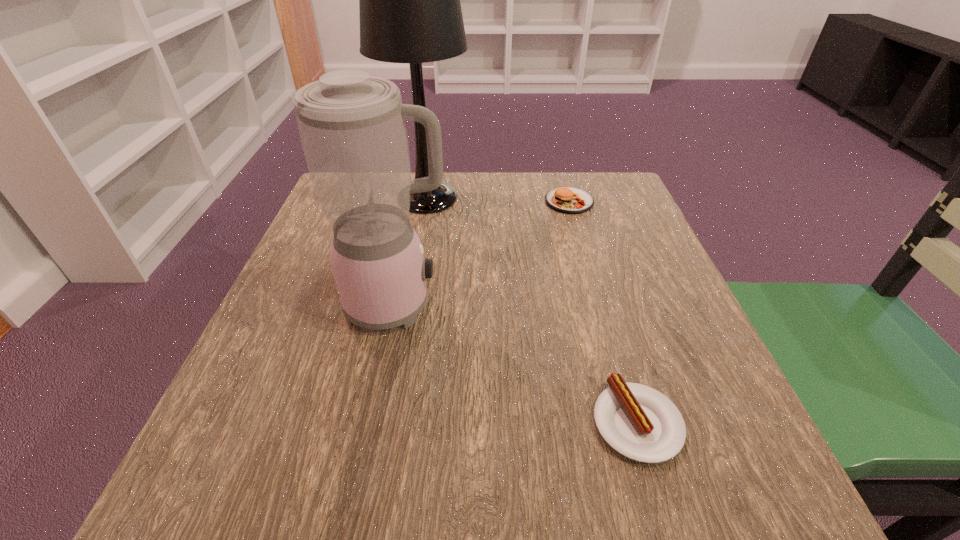
This screenshot has height=540, width=960. I want to click on free point between the patty and the nearest object, so 603,312.

Identify the location of unoccupied position between the table lamp and the sausage. Image resolution: width=960 pixels, height=540 pixels. (532, 310).

The image size is (960, 540). In order to click on vacant area between the sausage and the patty in this screenshot , I will do `click(603, 312)`.

At what (x,y) coordinates should I click in order to perform the action: click on vacant space that's between the sausage and the tallest object. Please return your answer as a coordinate pair (x, y). This screenshot has height=540, width=960. Looking at the image, I should click on (532, 310).

The image size is (960, 540). I want to click on unoccupied area between the sausage and the patty, so click(x=603, y=312).

I want to click on free spot between the sausage and the table lamp, so click(x=532, y=310).

At what (x,y) coordinates should I click in order to perform the action: click on object that is the second closest one to the patty. Please return your answer as a coordinate pair (x, y). The height and width of the screenshot is (540, 960). Looking at the image, I should click on (352, 127).

Image resolution: width=960 pixels, height=540 pixels. I want to click on object identified as the third closest to the third tallest object, so click(639, 422).

I want to click on free space that satisfies the following two spatial constraints: 1. on the back side of the sausage; 2. on the base of the third shortest object near the control knob, so (x=602, y=305).

The height and width of the screenshot is (540, 960). What are the coordinates of `blank space that satisfies the following two spatial constraints: 1. on the back side of the shortest object; 2. on the base of the second nearest object near the control knob` in the screenshot? It's located at (602, 305).